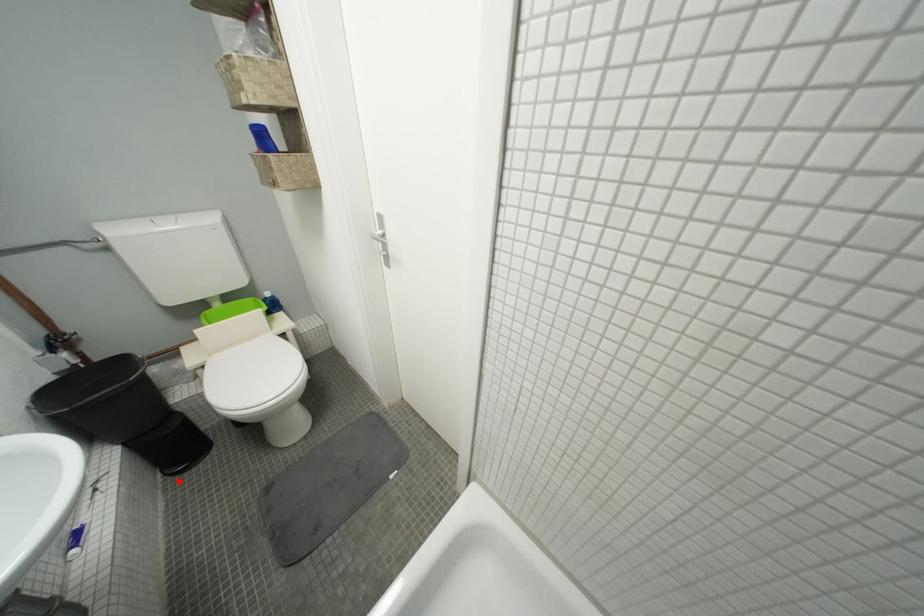
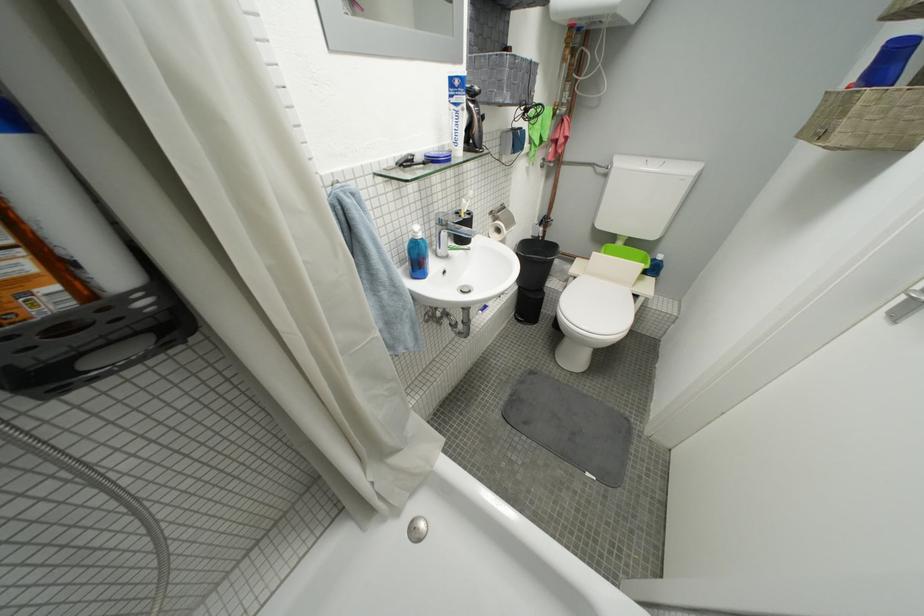
Locate, in the second image, the point that corresponds to the highlighted location in the first image.

(523, 322)